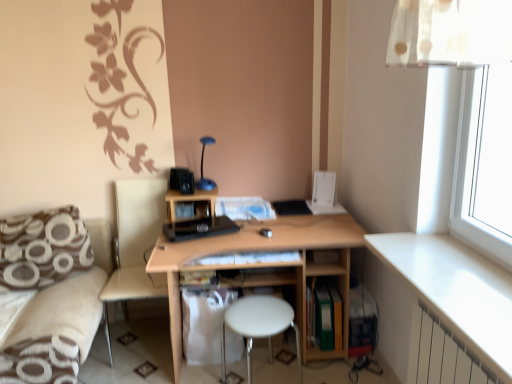
Locate an element on the screen. free region on the left part of green matte folder at lower right, which ranks as the 2th book in right-to-left order is located at coordinates (287, 348).